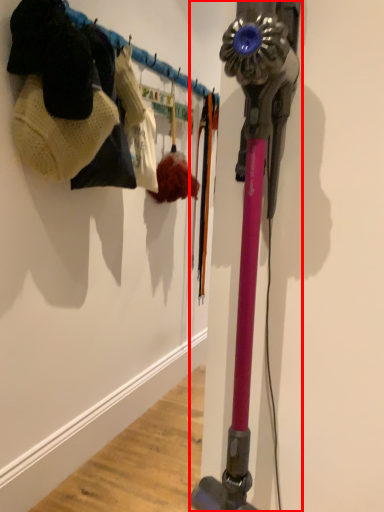
Question: In this image, where is vacuum (annotated by the red box) located relative to clothing?

Choices:
 (A) left
 (B) right

Answer: (B)